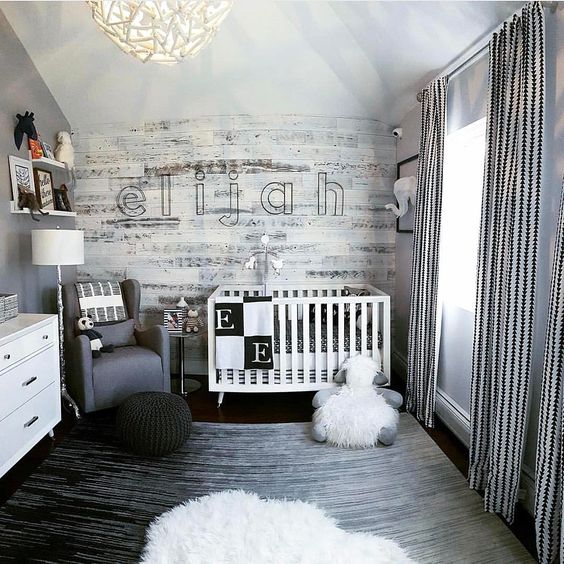
Where is `bean bag seat`? The image size is (564, 564). bean bag seat is located at coordinates [x=165, y=426].